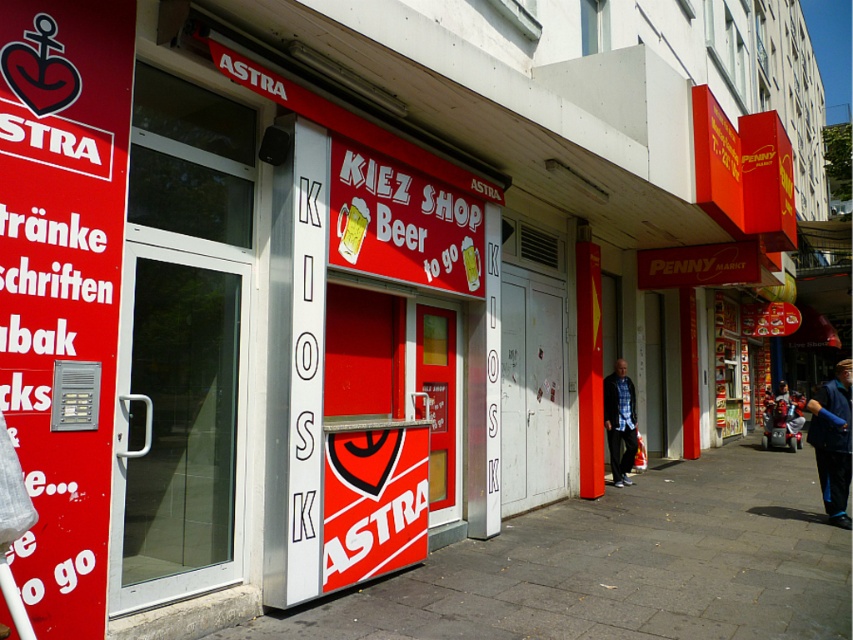
Is gray concrete pavement at center smaller than blue plaid shirt at center?

Actually, gray concrete pavement at center might be larger than blue plaid shirt at center.

I want to click on gray concrete pavement at center, so click(x=622, y=564).

Image resolution: width=853 pixels, height=640 pixels. Describe the element at coordinates (62, 288) in the screenshot. I see `matte red sign at left` at that location.

Image resolution: width=853 pixels, height=640 pixels. I want to click on matte red sign at left, so click(x=62, y=288).

What are the coordinates of `matte red sign at left` in the screenshot? It's located at (62, 288).

Image resolution: width=853 pixels, height=640 pixels. Describe the element at coordinates (833, 442) in the screenshot. I see `blue fabric jacket at lower right` at that location.

Between blue fabric jacket at lower right and blue plaid shirt at center, which one is positioned higher?

Positioned higher is blue fabric jacket at lower right.

Which is behind, point (822, 406) or point (630, 397)?

The point (630, 397) is more distant.

Where is `blue fabric jacket at lower right`? blue fabric jacket at lower right is located at coordinates (833, 442).